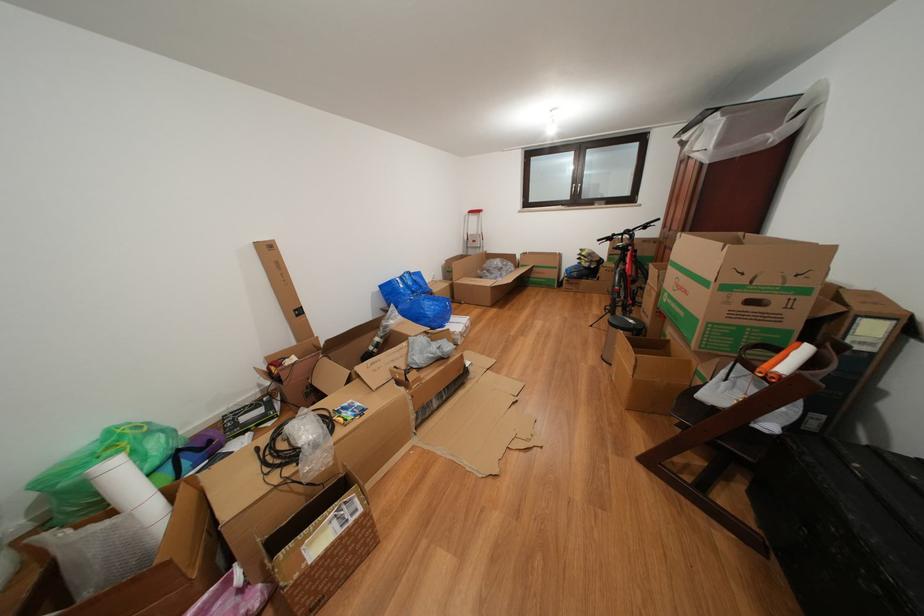
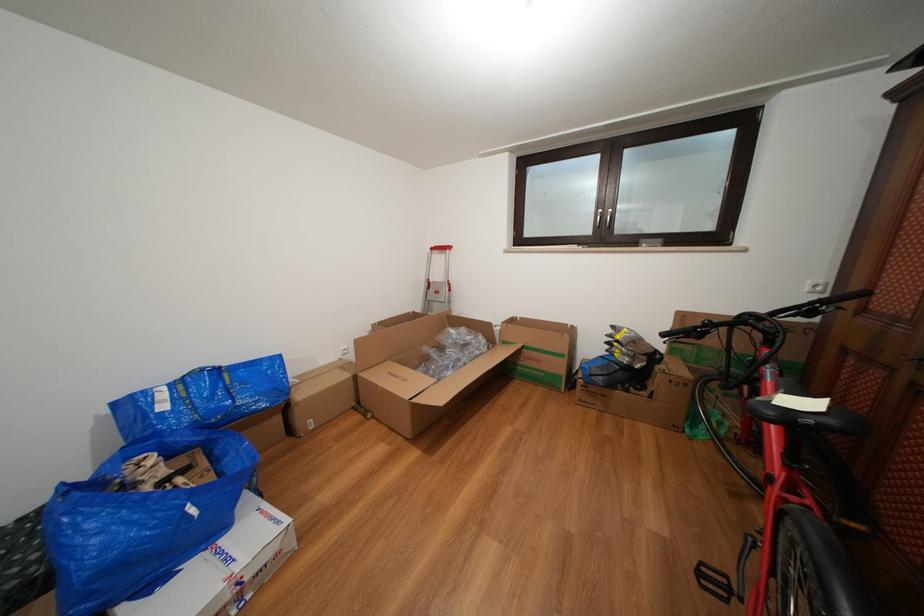
Locate, in the second image, the point that corresponds to (478,217) in the first image.

(441, 254)